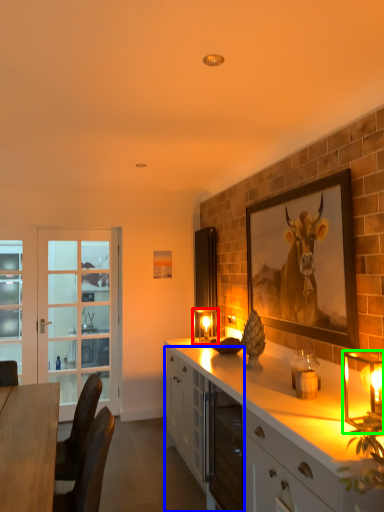
Question: Estimate the real-world distances between objects in this image. Which object is closer to candle holder (highlighted by a red box), cabinetry (highlighted by a blue box) or candle holder (highlighted by a green box)?

Choices:
 (A) cabinetry
 (B) candle holder

Answer: (A)